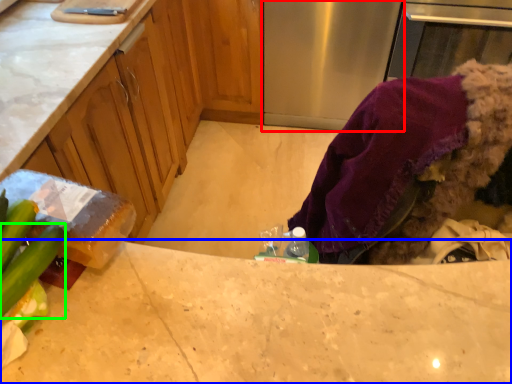
Question: Which object is positioned farthest from appliance (highlighted by a red box)? Select from countertop (highlighted by a blue box) and cucumber (highlighted by a green box).

Choices:
 (A) countertop
 (B) cucumber

Answer: (B)